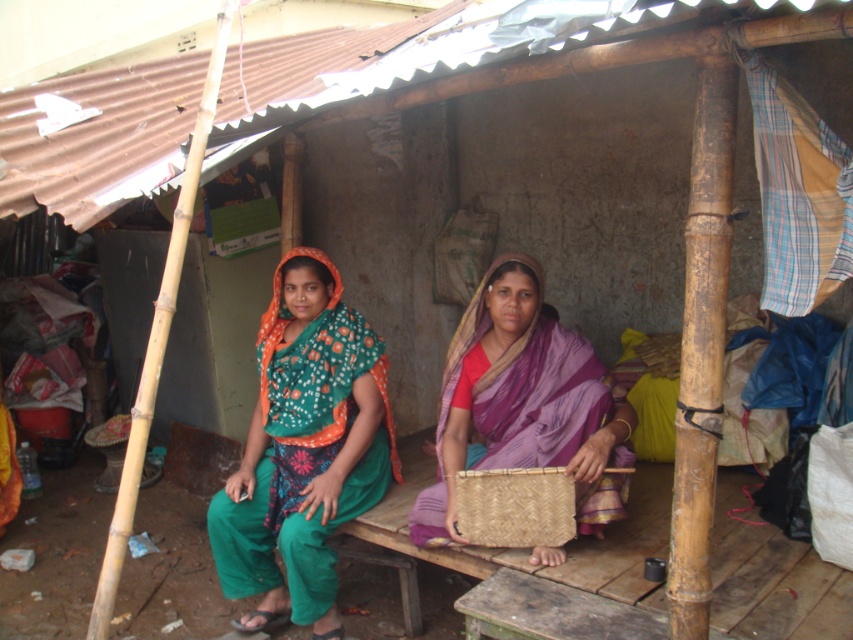
Question: Is green printed saree at center smaller than purple woven basket at center?

Choices:
 (A) no
 (B) yes

Answer: (A)

Question: Which point is farther to the camera?

Choices:
 (A) woven straw basket at center
 (B) green printed saree at center
 (C) purple woven basket at center

Answer: (B)

Question: Can you confirm if green printed saree at center is positioned above purple woven basket at center?

Choices:
 (A) no
 (B) yes

Answer: (A)

Question: Which object appears closest to the camera in this image?

Choices:
 (A) woven straw basket at center
 (B) green printed saree at center
 (C) purple woven basket at center

Answer: (A)

Question: In this image, where is purple woven basket at center located relative to woven straw basket at center?

Choices:
 (A) above
 (B) below

Answer: (A)

Question: Which point appears closest to the camera in this image?

Choices:
 (A) (532, 483)
 (B) (347, 385)
 (C) (515, 460)

Answer: (A)